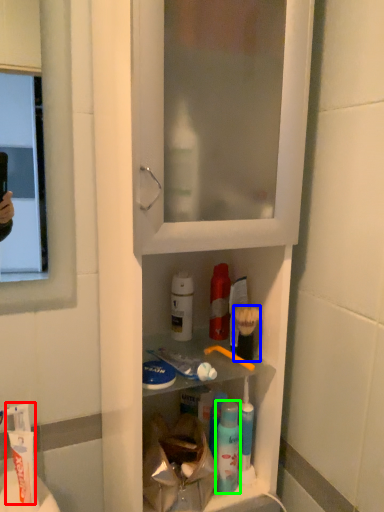
Question: Which is nearer to the toothpaste (highlighted by a red box)? brush (highlighted by a blue box) or mouthwash (highlighted by a green box).

Choices:
 (A) brush
 (B) mouthwash

Answer: (B)